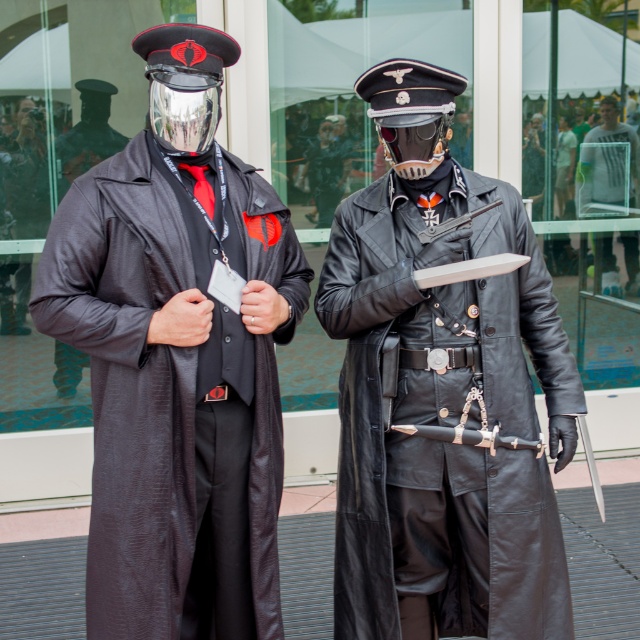
Is metallic silver helmet at center further to camera compared to light gray fabric shirt at center?

No, metallic silver helmet at center is closer to the viewer.

Does metallic silver helmet at center have a smaller size compared to light gray fabric shirt at center?

Correct, metallic silver helmet at center occupies less space than light gray fabric shirt at center.

At what (x,y) coordinates should I click in order to perform the action: click on metallic silver helmet at center. Please return your answer as a coordinate pair (x, y). This screenshot has height=640, width=640. Looking at the image, I should click on (410, 112).

From the picture: Is black leather coat at center above metallic reflective helmet at upper left?

Actually, black leather coat at center is below metallic reflective helmet at upper left.

Is black leather coat at center shorter than metallic reflective helmet at upper left?

No, black leather coat at center is not shorter than metallic reflective helmet at upper left.

Is point (458, 515) farther from viewer compared to point (218, 42)?

Yes, point (458, 515) is behind point (218, 42).

Find the location of a particular element. Image resolution: width=640 pixels, height=640 pixels. black leather coat at center is located at coordinates (444, 420).

Does metallic reflective helmet at upper left appear over metallic silver helmet at center?

Indeed, metallic reflective helmet at upper left is positioned over metallic silver helmet at center.

Does metallic reflective helmet at upper left appear under metallic silver helmet at center?

Incorrect, metallic reflective helmet at upper left is not positioned below metallic silver helmet at center.

Measure the distance between metallic reflective helmet at upper left and camera.

They are 2.11 meters apart.

You are a GUI agent. You are given a task and a screenshot of the screen. Output one action in this format:
    pyautogui.click(x=<x>, y=<y>)
    Task: Click on the metallic reflective helmet at upper left
    The width and height of the screenshot is (640, 640).
    Given the screenshot: What is the action you would take?
    pyautogui.click(x=184, y=81)